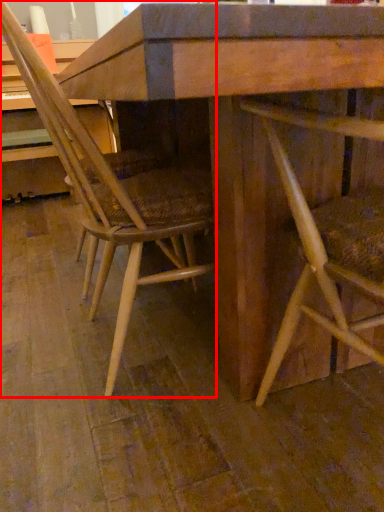
Question: Considering the relative positions of chair (annotated by the red box) and chair in the image provided, where is chair (annotated by the red box) located with respect to the staircase?

Choices:
 (A) left
 (B) right

Answer: (A)